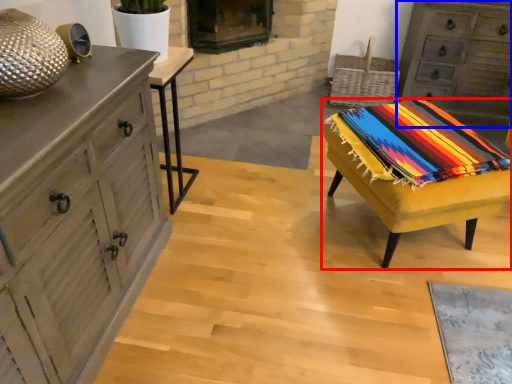
Question: Among these objects, which one is farthest to the camera, table (highlighted by a red box) or chest of drawers (highlighted by a blue box)?

Choices:
 (A) table
 (B) chest of drawers

Answer: (B)